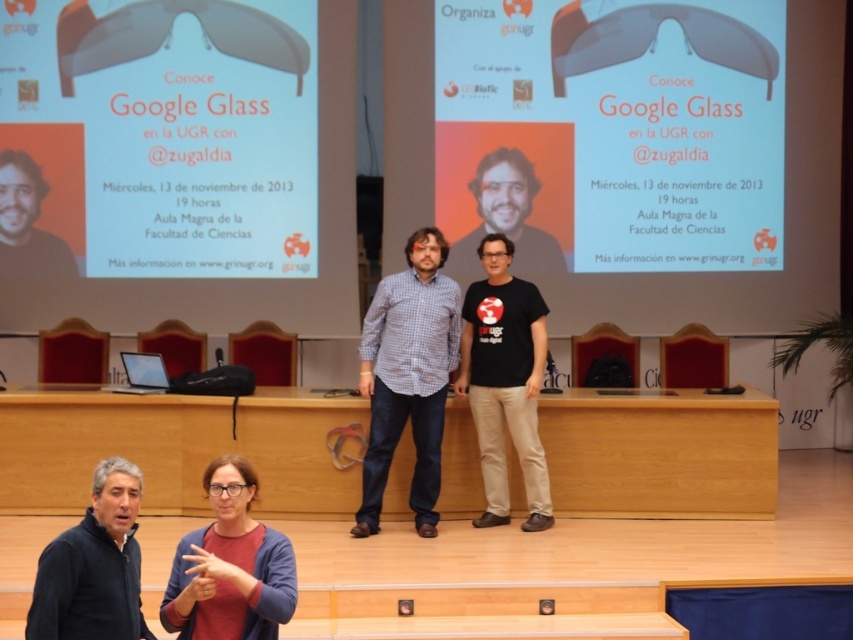
Question: Does black matte shirt at center have a lesser width compared to matte black face at left?

Choices:
 (A) yes
 (B) no

Answer: (B)

Question: Is checkered fabric shirt at center thinner than black matte shirt at center?

Choices:
 (A) no
 (B) yes

Answer: (B)

Question: Can you confirm if matte white google glass at upper center is positioned below matte black face at left?

Choices:
 (A) yes
 (B) no

Answer: (A)

Question: Which point is farther from the camera taking this photo?

Choices:
 (A) (109, 586)
 (B) (532, 349)
 (C) (393, 385)
 (D) (206, 289)

Answer: (D)

Question: Which of the following is the closest to the observer?

Choices:
 (A) black matte jacket at lower left
 (B) black matte t-shirt at center
 (C) matte black face at left

Answer: (A)

Question: Which point is farther to the camera?

Choices:
 (A) black matte t-shirt at center
 (B) checkered fabric shirt at center
 (C) black matte jacket at lower left

Answer: (A)